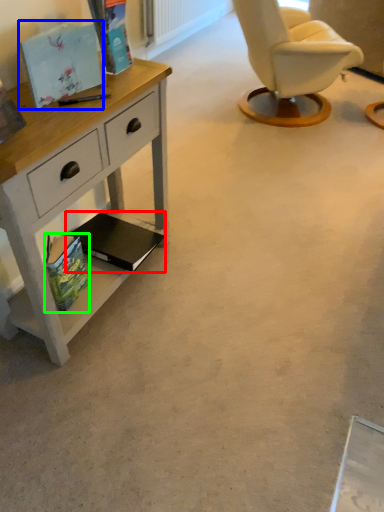
Question: Based on their relative distances, which object is farther from magazine (highlighted by a red box)? Choose from magazine (highlighted by a blue box) and magazine (highlighted by a green box).

Choices:
 (A) magazine
 (B) magazine

Answer: (A)